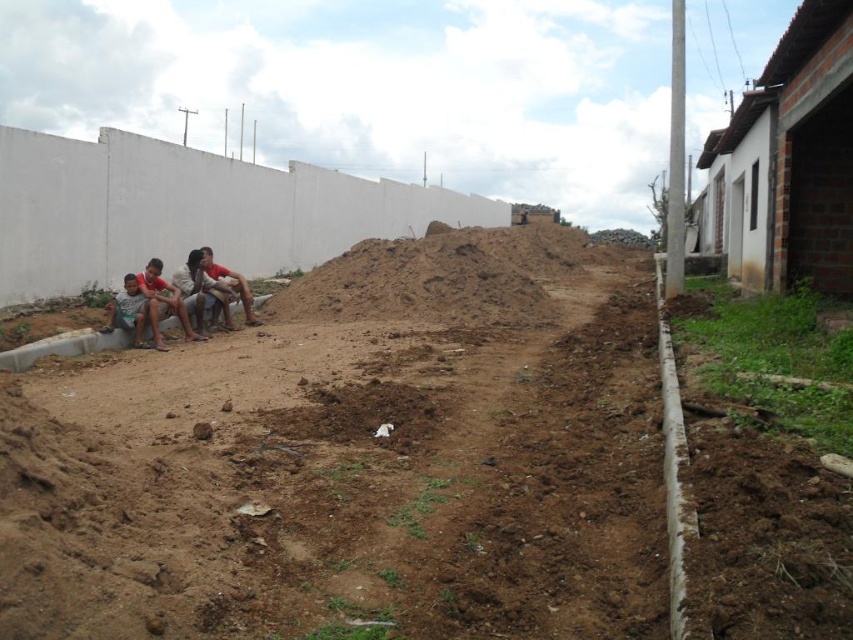
Question: Which point is farther from the camera taking this photo?

Choices:
 (A) (222, 273)
 (B) (146, 320)

Answer: (A)

Question: Which object appears closest to the camera in this image?

Choices:
 (A) light brown wooden bench at lower left
 (B) matte skin person at center left
 (C) light brown skin at left

Answer: (C)

Question: Which point is farther from the camera taking this photo?

Choices:
 (A) (213, 262)
 (B) (204, 264)
 (C) (155, 310)

Answer: (A)

Question: Can you confirm if light brown skin at left is smaller than matte skin person at center left?

Choices:
 (A) yes
 (B) no

Answer: (A)

Question: Is the position of light brown skin at left more distant than that of matte skin person at center left?

Choices:
 (A) no
 (B) yes

Answer: (A)

Question: Can you confirm if light brown wooden bench at lower left is positioned to the left of matte skin person at center left?

Choices:
 (A) yes
 (B) no

Answer: (A)